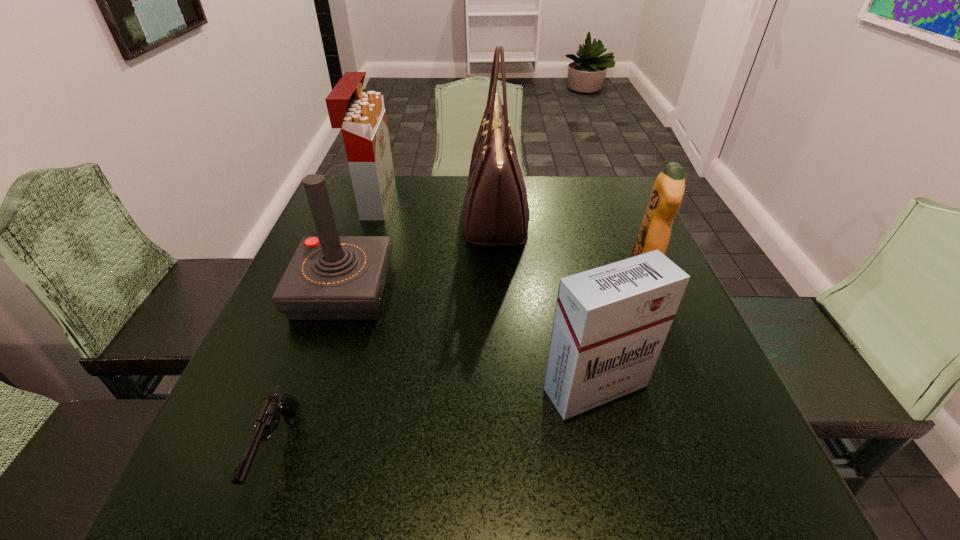
Locate an element on the screen. vacant area that lies between the tallest object and the nearer cigarette case is located at coordinates (545, 302).

You are a GUI agent. You are given a task and a screenshot of the screen. Output one action in this format:
    pyautogui.click(x=<x>, y=<y>)
    Task: Click on the vacant area that lies between the handbag and the rightmost object
    This screenshot has width=960, height=540.
    Given the screenshot: What is the action you would take?
    pyautogui.click(x=570, y=243)

Identify the location of free space between the detergent and the tallest object. This screenshot has height=540, width=960. point(570,243).

Locate an element on the screen. This screenshot has width=960, height=540. vacant region between the detergent and the joystick is located at coordinates (493, 280).

Identify which object is located as the second nearest to the gun. Please provide its 2D coordinates. Your answer should be formatted as a tuple, i.e. [(x, y)], where the tuple contains the x and y coordinates of a point satisfying the conditions above.

[(610, 323)]

At what (x,y) coordinates should I click in order to perform the action: click on object that can be found as the fifth closest to the right cigarette case. Please return your answer as a coordinate pair (x, y). Image resolution: width=960 pixels, height=540 pixels. Looking at the image, I should click on (361, 116).

Where is `vacant position in the image that satisfies the following two spatial constraints: 1. on the front-facing side of the nearer cigarette case; 2. on the left side of the handbag`? The image size is (960, 540). vacant position in the image that satisfies the following two spatial constraints: 1. on the front-facing side of the nearer cigarette case; 2. on the left side of the handbag is located at coordinates (504, 387).

At what (x,y) coordinates should I click in order to perform the action: click on free location that satisfies the following two spatial constraints: 1. with the lid open on the shorter cigarette case; 2. on the left side of the farther cigarette case. Please return your answer as a coordinate pair (x, y). Looking at the image, I should click on (311, 387).

At what (x,y) coordinates should I click in order to perform the action: click on free spot that satisfies the following two spatial constraints: 1. with the lid open on the left cigarette case; 2. on the rectangular base of the joystick. Please return your answer as a coordinate pair (x, y). Looking at the image, I should click on (345, 291).

This screenshot has height=540, width=960. Find the location of `free space that satisfies the following two spatial constraints: 1. with the lid open on the farther cigarette case; 2. on the rectangular base of the joystick`. free space that satisfies the following two spatial constraints: 1. with the lid open on the farther cigarette case; 2. on the rectangular base of the joystick is located at coordinates pyautogui.click(x=345, y=291).